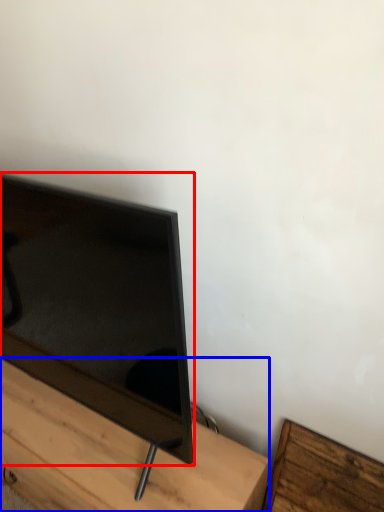
Question: Which point is further to the camera, television (highlighted by a red box) or furniture (highlighted by a blue box)?

Choices:
 (A) television
 (B) furniture

Answer: (B)